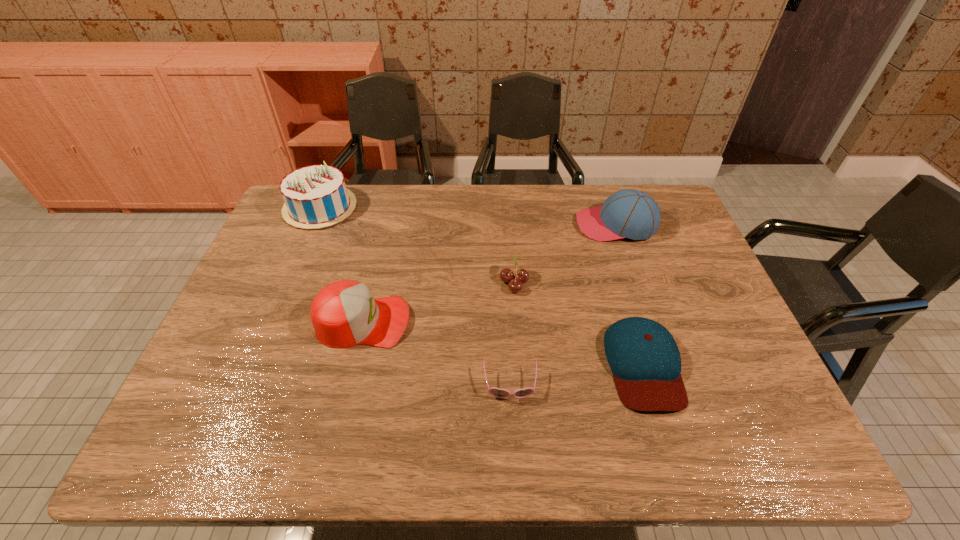
Find the location of a particular element. The image size is (960, 540). vacant space in between the leftmost baseball cap and the birthday cake is located at coordinates (342, 265).

This screenshot has width=960, height=540. Find the location of `vacant area that lies between the shortest baseball cap and the birthday cake`. vacant area that lies between the shortest baseball cap and the birthday cake is located at coordinates (482, 286).

The height and width of the screenshot is (540, 960). Find the location of `free space between the leftmost baseball cap and the farthest baseball cap`. free space between the leftmost baseball cap and the farthest baseball cap is located at coordinates (490, 273).

Locate an element on the screen. This screenshot has width=960, height=540. empty location between the farthest baseball cap and the shortest baseball cap is located at coordinates (630, 295).

I want to click on free space that is in between the farthest baseball cap and the shortest object, so click(564, 305).

Locate an element on the screen. The width and height of the screenshot is (960, 540). empty space between the leftmost baseball cap and the farthest baseball cap is located at coordinates (490, 273).

Where is `free space between the third farthest object and the leftmost baseball cap`? The width and height of the screenshot is (960, 540). free space between the third farthest object and the leftmost baseball cap is located at coordinates (439, 302).

You are a GUI agent. You are given a task and a screenshot of the screen. Output one action in this format:
    pyautogui.click(x=<x>, y=<y>)
    Task: Click on the object that is the second nearest to the farthest baseball cap
    Image resolution: width=960 pixels, height=540 pixels.
    Given the screenshot: What is the action you would take?
    pyautogui.click(x=644, y=358)

Where is `object that stands as the second closest to the fourth nearest object`? The image size is (960, 540). object that stands as the second closest to the fourth nearest object is located at coordinates (629, 213).

I want to click on baseball cap that can be found as the third closest to the sunglasses, so click(629, 213).